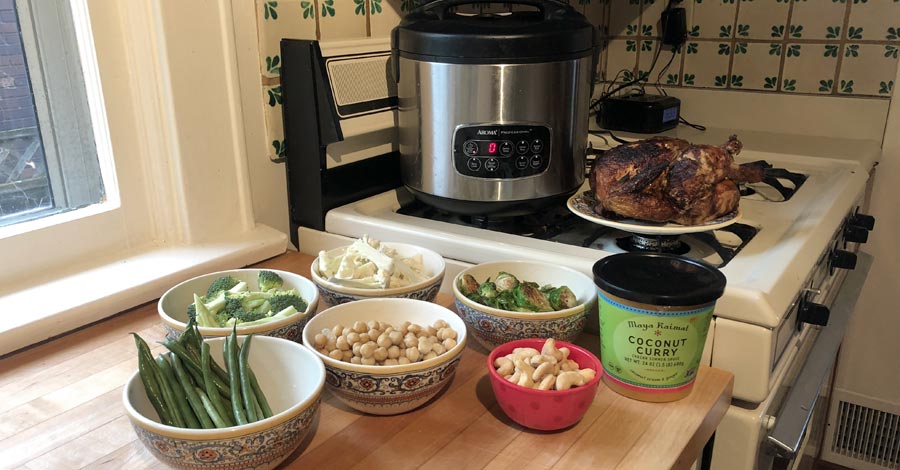
Locate an element on the screen. oven door handle is located at coordinates (819, 368).